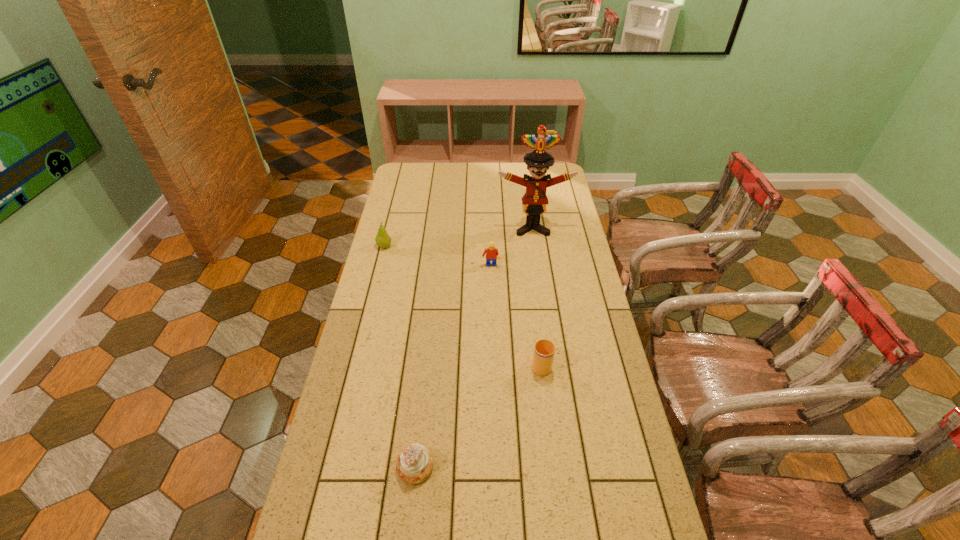
Identify the location of vacant region located on the front-facing side of the Lego. The image size is (960, 540). (492, 330).

Locate an element on the screen. This screenshot has width=960, height=540. free region located on the side of the fourth farthest object with the handle is located at coordinates (538, 336).

Locate an element on the screen. free space located 0.200m on the side of the fourth farthest object with the handle is located at coordinates (535, 308).

Image resolution: width=960 pixels, height=540 pixels. In order to click on vacant position located on the side of the fourth farthest object with the handle in this screenshot , I will do `click(536, 321)`.

You are a GUI agent. You are given a task and a screenshot of the screen. Output one action in this format:
    pyautogui.click(x=<x>, y=<y>)
    Task: Click on the free spot located on the back of the nearest object
    The image size is (960, 540).
    Given the screenshot: What is the action you would take?
    pyautogui.click(x=426, y=366)

Where is `object present at the left edge`? Image resolution: width=960 pixels, height=540 pixels. object present at the left edge is located at coordinates (383, 240).

This screenshot has width=960, height=540. I want to click on object that is positioned at the right edge, so click(x=534, y=201).

This screenshot has width=960, height=540. In the image, there is a desktop. Identify the location of vacant space at the far edge. pos(509,181).

Find the location of a particular element. The image size is (960, 540). vacant area at the left edge is located at coordinates (358, 376).

Where is `vacant space at the right edge of the desktop`? vacant space at the right edge of the desktop is located at coordinates pos(547,215).